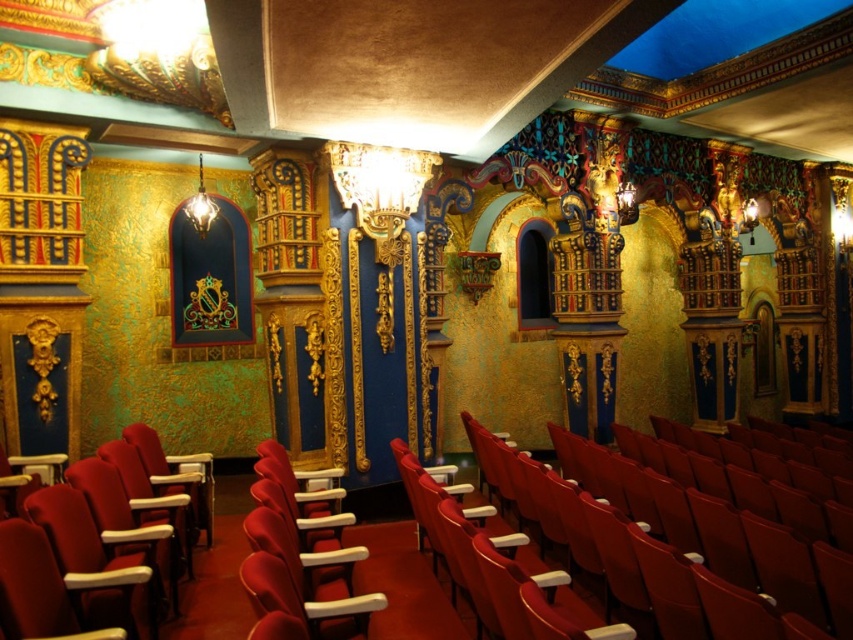
You are sitting in the theater and want to move from the velvet red seat at left to the matte red seat at center. Which direction should you move to reach it?

The matte red seat at center is located below the velvet red seat at left, so you should move downward to reach it.

You are sitting in the velvet red seat at left and want to move to the matte red seat at center. Which direction should you move in the theater?

The matte red seat at center is to the right of the velvet red seat at left, so you should move to the right to reach it.

You are attending a play and need to choose a seat that offers better visibility. Based on the theater interior described, which seat between the matte red seat at center and the velvet red seat at left would you recommend for better visibility?

The velvet red seat at left is taller than the matte red seat at center, so it offers better visibility.